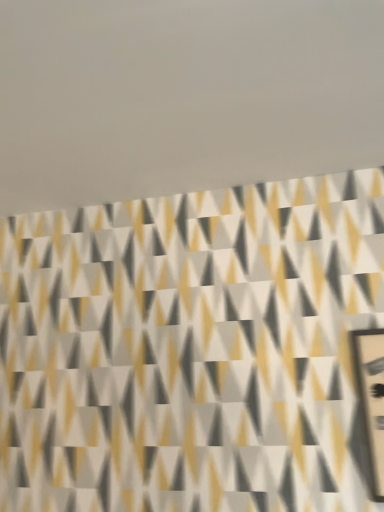
The width and height of the screenshot is (384, 512). I want to click on matte yellow and gray patterned fabric at bottom, so click(x=183, y=96).

The image size is (384, 512). What do you see at coordinates (183, 96) in the screenshot? I see `matte yellow and gray patterned fabric at bottom` at bounding box center [183, 96].

Where is `matte yellow and gray patterned fabric at bottom`? matte yellow and gray patterned fabric at bottom is located at coordinates (183, 96).